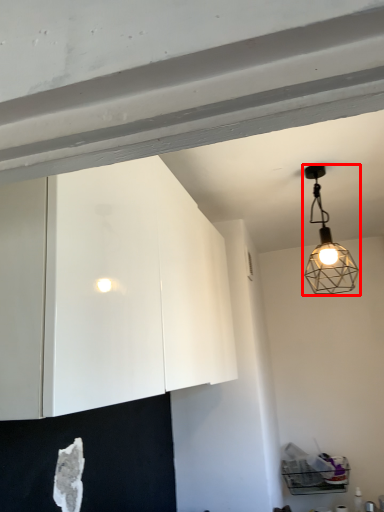
Question: Observing the image, what is the correct spatial positioning of lamp (annotated by the red box) in reference to cabinetry?

Choices:
 (A) left
 (B) right

Answer: (B)